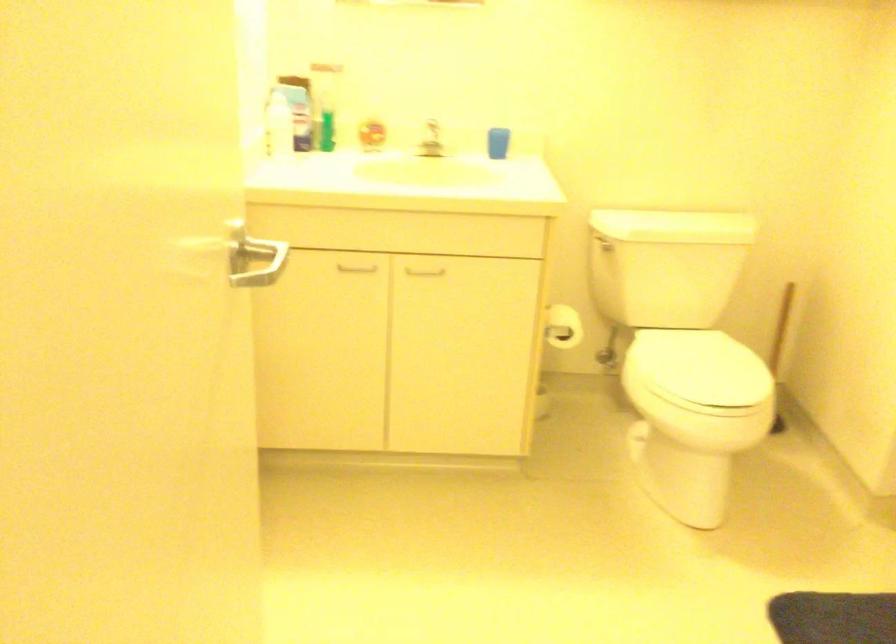
This screenshot has width=896, height=644. What do you see at coordinates (254, 261) in the screenshot? I see `the silver door handle` at bounding box center [254, 261].